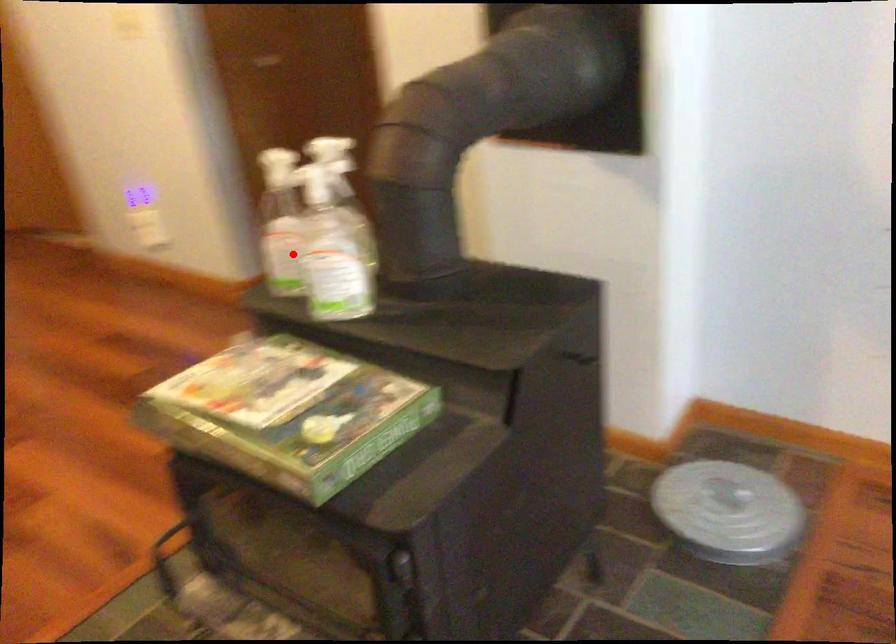
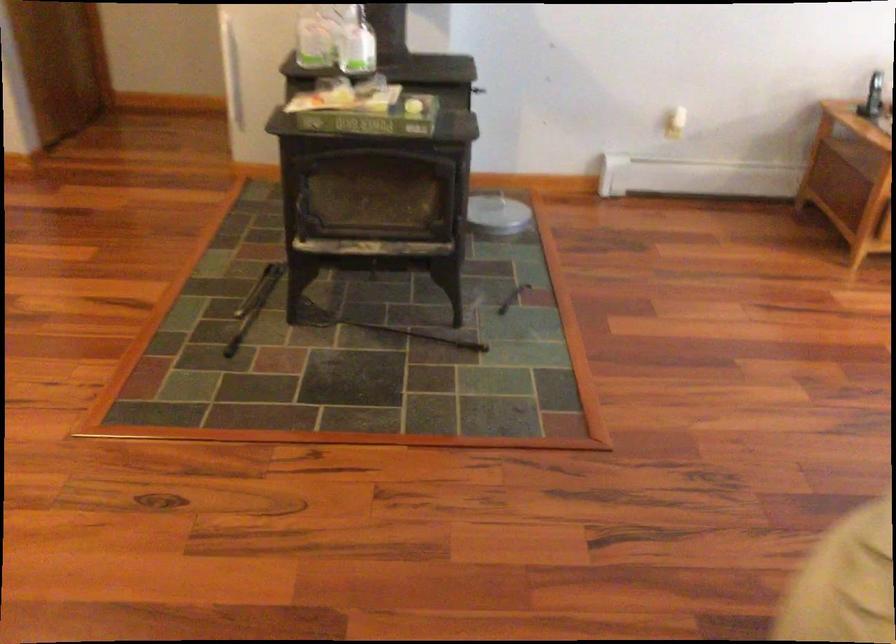
The point at the highlighted location is marked in the first image. Where is the corresponding point in the second image?

(314, 41)